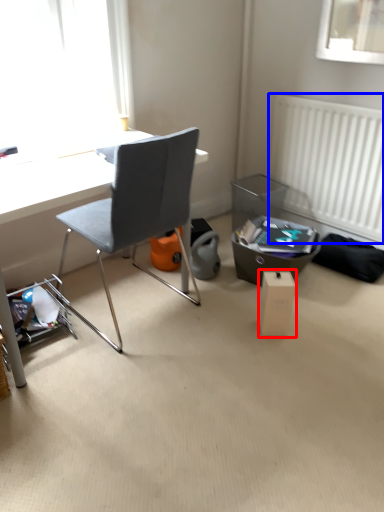
Question: Among these objects, which one is farthest to the camera, cardboard box (highlighted by a red box) or radiator (highlighted by a blue box)?

Choices:
 (A) cardboard box
 (B) radiator

Answer: (B)